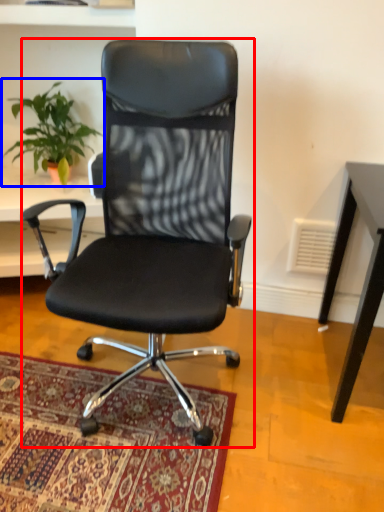
Question: Which of the following is the farthest to the observer, chair (highlighted by a red box) or houseplant (highlighted by a blue box)?

Choices:
 (A) chair
 (B) houseplant

Answer: (B)